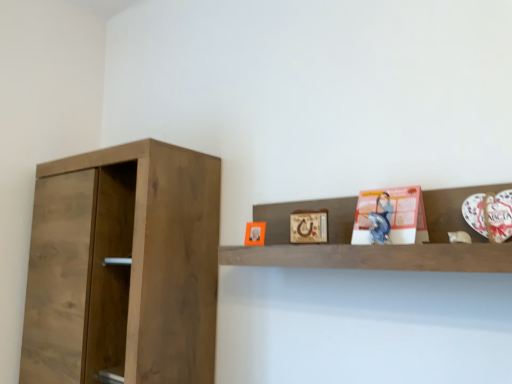
Question: Is wooden shelf at upper center touching matte orange picture frame at upper center, which is the 1th picture frame in left-to-right order?

Choices:
 (A) no
 (B) yes

Answer: (A)

Question: Is wooden shelf at upper center to the right of matte orange picture frame at upper center, positioned as the second picture frame in right-to-left order, from the viewer's perspective?

Choices:
 (A) no
 (B) yes

Answer: (B)

Question: Can you confirm if wooden shelf at upper center is shorter than matte orange picture frame at upper center, the second picture frame from the front?

Choices:
 (A) no
 (B) yes

Answer: (A)

Question: Can you confirm if wooden shelf at upper center is positioned to the left of matte orange picture frame at upper center, the second picture frame from the front?

Choices:
 (A) yes
 (B) no

Answer: (B)

Question: From a real-world perspective, is wooden shelf at upper center positioned under matte orange picture frame at upper center, positioned as the second picture frame in right-to-left order, based on gravity?

Choices:
 (A) yes
 (B) no

Answer: (B)

Question: Considering the positions of point (414, 226) and point (457, 246), is point (414, 226) closer or farther from the camera than point (457, 246)?

Choices:
 (A) closer
 (B) farther

Answer: (B)

Question: Looking at their shapes, would you say matte pink paper at upper right is wider or thinner than wooden shelf at upper center?

Choices:
 (A) thin
 (B) wide

Answer: (A)

Question: Is matte pink paper at upper right to the left or to the right of wooden shelf at upper center in the image?

Choices:
 (A) left
 (B) right

Answer: (B)

Question: From the image's perspective, is matte pink paper at upper right located above or below wooden shelf at upper center?

Choices:
 (A) above
 (B) below

Answer: (A)

Question: Considering the positions of walnut wood cupboard at left and wooden picture frame at upper center, positioned as the first picture frame in front-to-back order, in the image, is walnut wood cupboard at left wider or thinner than wooden picture frame at upper center, positioned as the first picture frame in front-to-back order,?

Choices:
 (A) thin
 (B) wide

Answer: (B)

Question: Relative to wooden picture frame at upper center, positioned as the first picture frame in front-to-back order, is walnut wood cupboard at left in front or behind?

Choices:
 (A) behind
 (B) front

Answer: (A)

Question: Based on their positions, is walnut wood cupboard at left located to the left or right of wooden picture frame at upper center, positioned as the first picture frame in front-to-back order?

Choices:
 (A) right
 (B) left

Answer: (B)

Question: Is walnut wood cupboard at left taller or shorter than wooden picture frame at upper center, the 2th picture frame when ordered from back to front?

Choices:
 (A) tall
 (B) short

Answer: (A)

Question: In terms of width, does wooden shelf at upper center look wider or thinner when compared to walnut wood cupboard at left?

Choices:
 (A) thin
 (B) wide

Answer: (A)

Question: Is point (401, 244) positioned closer to the camera than point (138, 155)?

Choices:
 (A) farther
 (B) closer

Answer: (B)